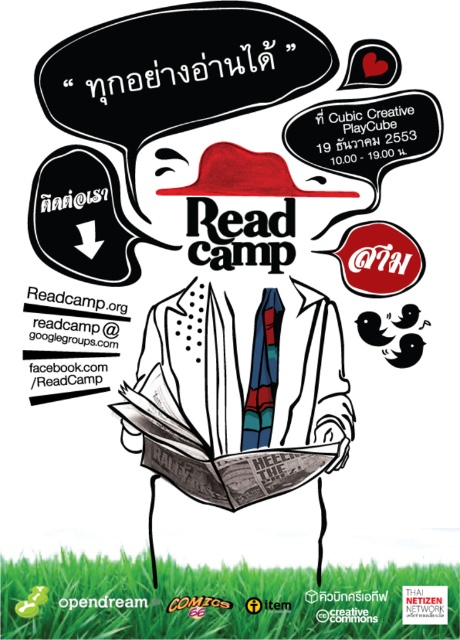
Question: Which point is farther to the camera?

Choices:
 (A) stained glass tie at center
 (B) white dotted shirt at center

Answer: (A)

Question: Estimate the real-world distances between objects in this image. Which object is farther from the white dotted shirt at center?

Choices:
 (A) black matte birds at center
 (B) stained glass tie at center

Answer: (A)

Question: Does stained glass tie at center have a greater width compared to black matte birds at center?

Choices:
 (A) no
 (B) yes

Answer: (A)

Question: Considering the relative positions of stained glass tie at center and black matte birds at center in the image provided, where is stained glass tie at center located with respect to black matte birds at center?

Choices:
 (A) left
 (B) right

Answer: (A)

Question: Does white dotted shirt at center come behind black matte birds at center?

Choices:
 (A) no
 (B) yes

Answer: (A)

Question: Which object is positioned closest to the white dotted shirt at center?

Choices:
 (A) black matte birds at center
 (B) stained glass tie at center

Answer: (B)